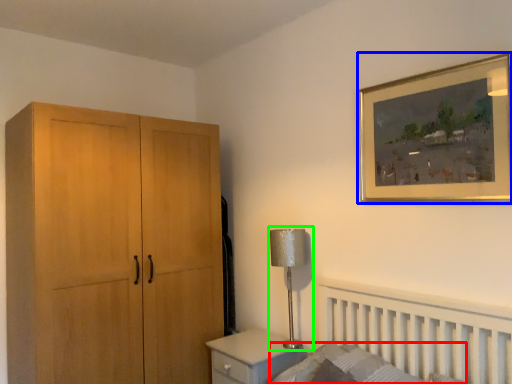
Question: Estimate the real-world distances between objects in this image. Which object is farther from mattress (highlighted by a red box), picture frame (highlighted by a blue box) or table lamp (highlighted by a green box)?

Choices:
 (A) picture frame
 (B) table lamp

Answer: (A)